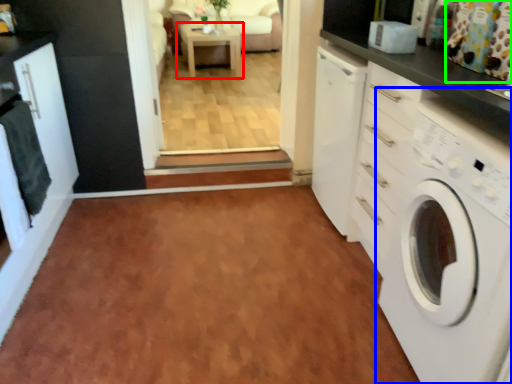
Question: Based on their relative distances, which object is nearer to table (highlighted by a red box)? Choose from washing machine (highlighted by a blue box) and curtain (highlighted by a green box).

Choices:
 (A) washing machine
 (B) curtain

Answer: (B)